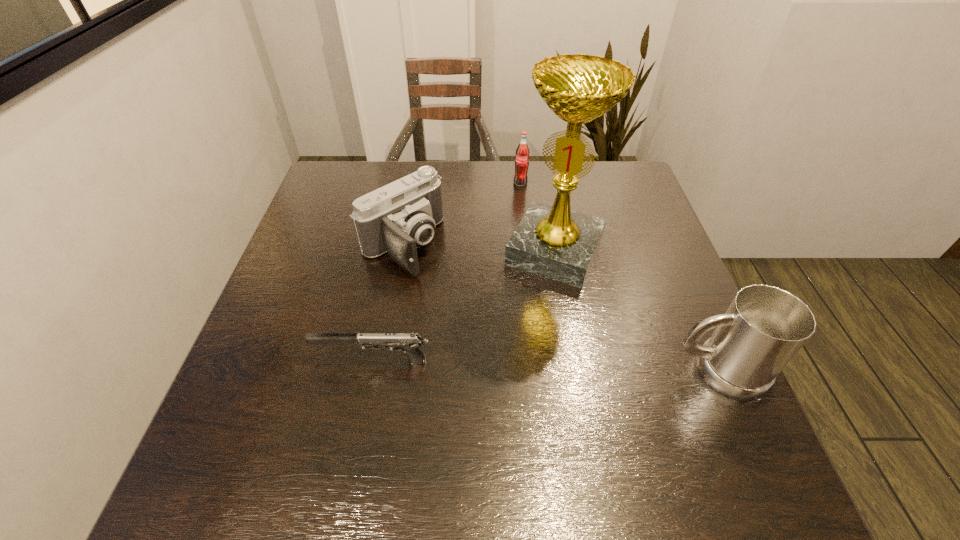
Locate an element on the screen. Image resolution: width=960 pixels, height=540 pixels. object at the left edge is located at coordinates (409, 343).

Find the location of `mug at the right edge`. mug at the right edge is located at coordinates (764, 327).

Where is `award present at the right edge`? award present at the right edge is located at coordinates (554, 242).

The image size is (960, 540). Identify the location of object located at the near right corner. (764, 327).

I want to click on blank space at the far edge of the desktop, so click(495, 162).

You are a GUI agent. You are given a task and a screenshot of the screen. Output one action in this format:
    pyautogui.click(x=<x>, y=<y>)
    Task: Click on the vacant space at the near edge
    The image size is (960, 540).
    Given the screenshot: What is the action you would take?
    pyautogui.click(x=485, y=392)

In the image, there is a desktop. Where is `free space at the left edge`? The image size is (960, 540). free space at the left edge is located at coordinates (313, 362).

Where is `free space at the right edge`? free space at the right edge is located at coordinates coord(701,343).

Identify the location of vacant space at the far left corner. This screenshot has width=960, height=540. tap(321, 201).

Locate an element on the screen. free space at the far right corner of the desktop is located at coordinates [625, 188].